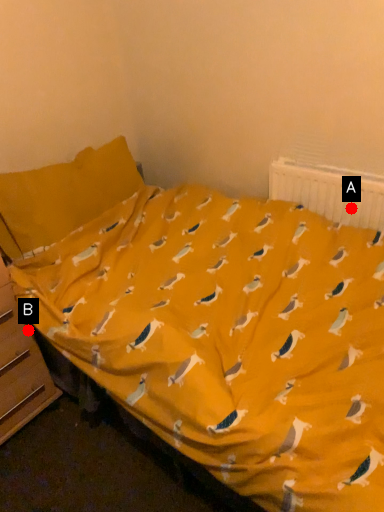
Question: Two points are circled on the image, labeled by A and B beside each circle. Which point is farther to the camera?

Choices:
 (A) A is further
 (B) B is further

Answer: (A)